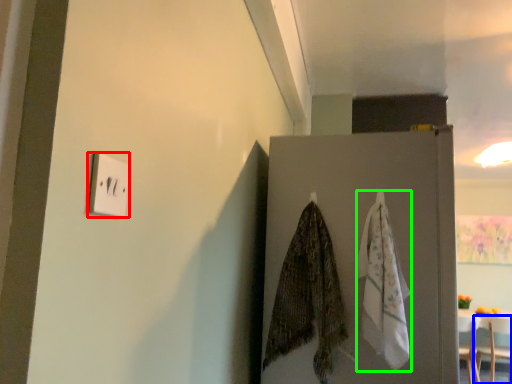
Question: Which is nearer to the light switch (highlighted by a red box)? furniture (highlighted by a blue box) or blanket (highlighted by a green box).

Choices:
 (A) furniture
 (B) blanket

Answer: (B)